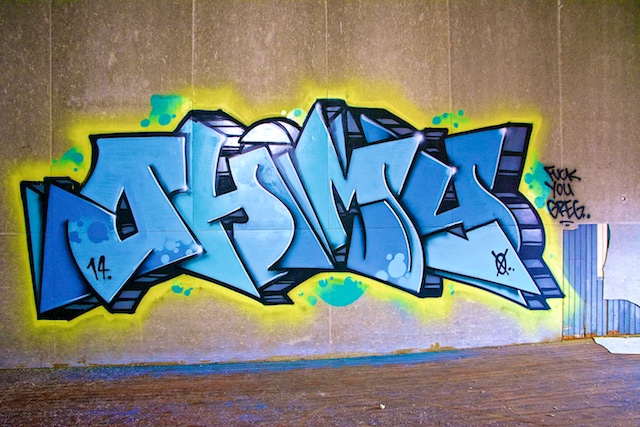
Locate an element on the screen. This screenshot has height=427, width=640. wall is located at coordinates (312, 63).